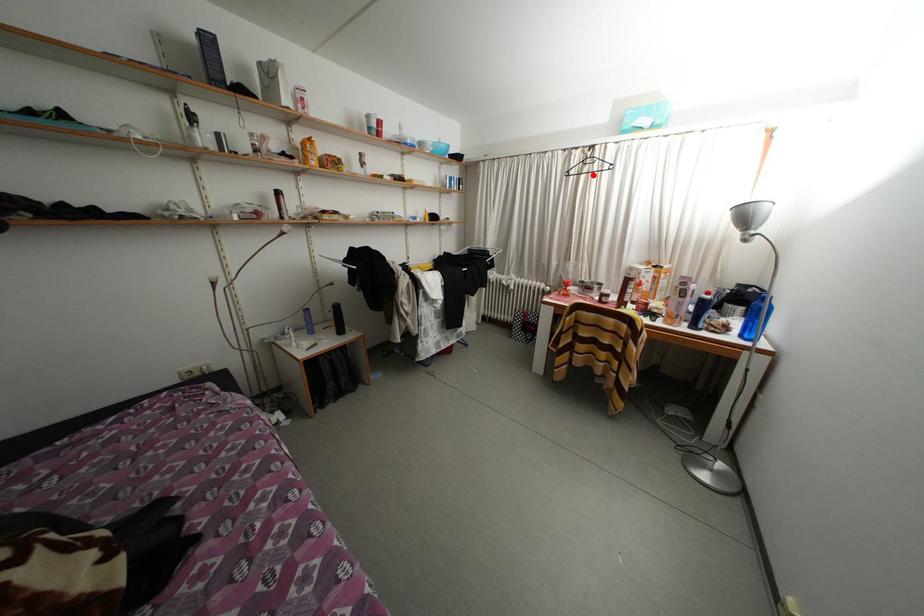
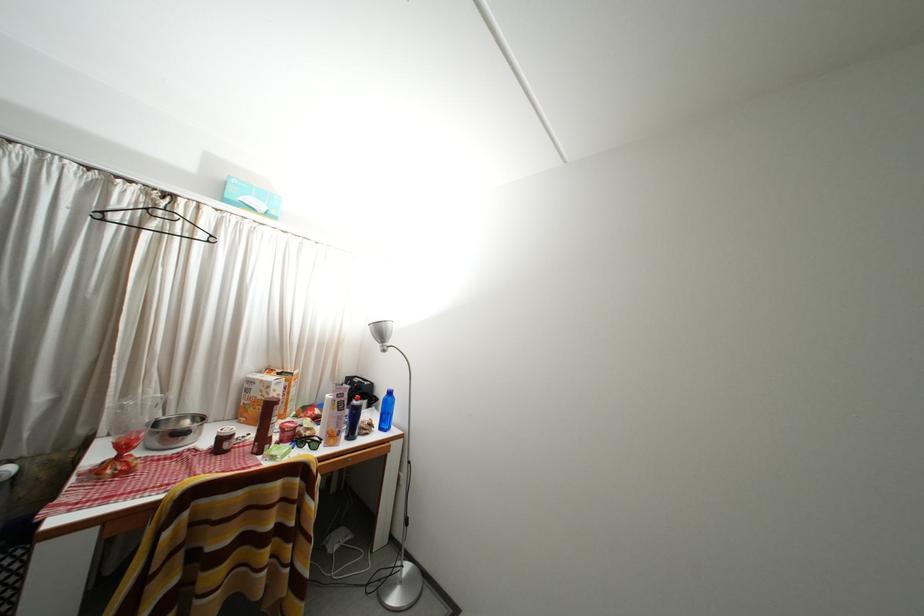
Question: I am providing you with two images of the same scene from different viewpoints. A red point is marked on the first image. At the location where the point appears in image 1, is it still visible in image 2?

Choices:
 (A) Yes
 (B) No

Answer: (A)